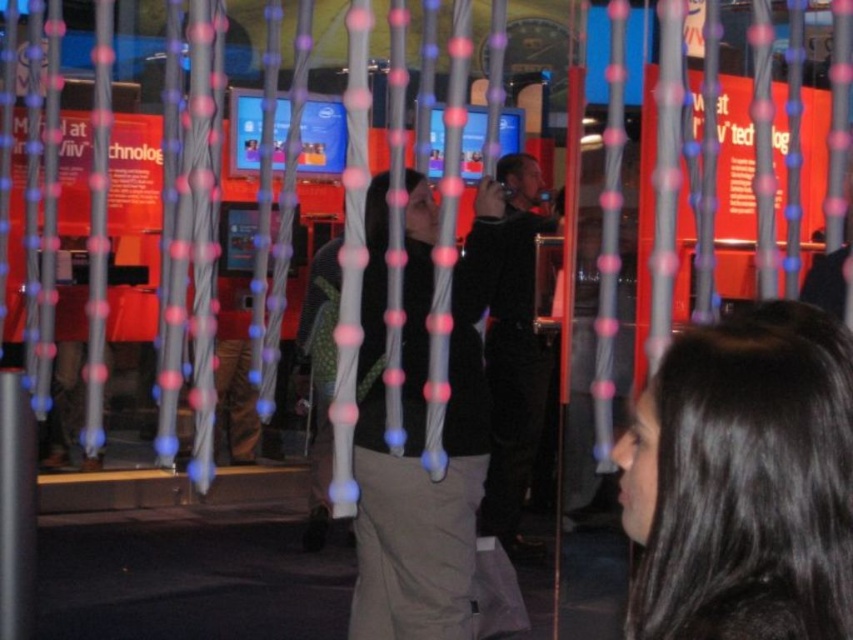
Is black hair at upper right positioned in front of dark blue fabric jacket at center?

That is True.

Does black hair at upper right appear under dark blue fabric jacket at center?

Indeed, black hair at upper right is positioned under dark blue fabric jacket at center.

The width and height of the screenshot is (853, 640). I want to click on black hair at upper right, so click(744, 481).